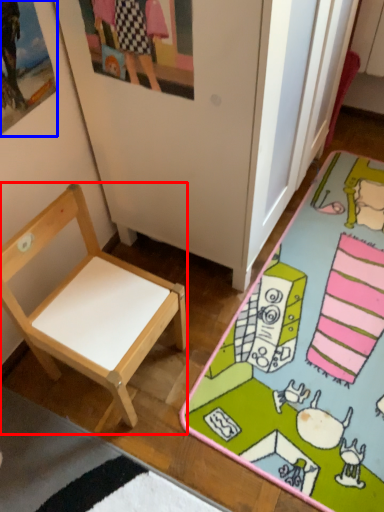
Question: Which point is further to the camera, chair (highlighted by a red box) or picture frame (highlighted by a blue box)?

Choices:
 (A) chair
 (B) picture frame

Answer: (A)